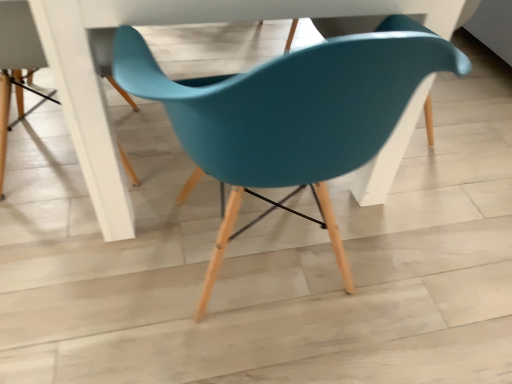
Question: In which direction should I rotate to look at teal plastic chair at upper center, which ranks as the 1th chair in left-to-right order?

Choices:
 (A) left
 (B) right

Answer: (A)

Question: Can you confirm if teal plastic chair at upper center, acting as the second chair starting from the right, is bigger than teal plastic chair at center, the first chair in the right-to-left sequence?

Choices:
 (A) no
 (B) yes

Answer: (A)

Question: Would you say teal plastic chair at center, the first chair in the right-to-left sequence, is part of teal plastic chair at upper center, acting as the second chair starting from the right,'s contents?

Choices:
 (A) no
 (B) yes

Answer: (A)

Question: Is teal plastic chair at upper center, acting as the second chair starting from the right, positioned before teal plastic chair at center, the first chair in the right-to-left sequence?

Choices:
 (A) yes
 (B) no

Answer: (B)

Question: From the image's perspective, would you say teal plastic chair at upper center, which ranks as the 1th chair in left-to-right order, is positioned over teal plastic chair at center, the first chair in the right-to-left sequence?

Choices:
 (A) yes
 (B) no

Answer: (A)

Question: From a real-world perspective, is teal plastic chair at upper center, acting as the second chair starting from the right, located beneath teal plastic chair at center, which is the 2th chair in left-to-right order?

Choices:
 (A) no
 (B) yes

Answer: (B)

Question: Is teal plastic chair at upper center, acting as the second chair starting from the right, thinner than teal plastic chair at center, which is the 2th chair in left-to-right order?

Choices:
 (A) yes
 (B) no

Answer: (A)

Question: Is teal plastic chair at center, which is the 2th chair in left-to-right order, not within teal plastic chair at upper center, which ranks as the 1th chair in left-to-right order?

Choices:
 (A) no
 (B) yes

Answer: (B)

Question: Is teal plastic chair at center, which is the 2th chair in left-to-right order, positioned with its back to teal plastic chair at upper center, acting as the second chair starting from the right?

Choices:
 (A) yes
 (B) no

Answer: (B)

Question: Is teal plastic chair at center, the first chair in the right-to-left sequence, placed right next to teal plastic chair at upper center, acting as the second chair starting from the right?

Choices:
 (A) no
 (B) yes

Answer: (A)

Question: From the image's perspective, would you say teal plastic chair at center, which is the 2th chair in left-to-right order, is shown under teal plastic chair at upper center, acting as the second chair starting from the right?

Choices:
 (A) no
 (B) yes

Answer: (B)

Question: From a real-world perspective, is teal plastic chair at center, which is the 2th chair in left-to-right order, physically below teal plastic chair at upper center, which ranks as the 1th chair in left-to-right order?

Choices:
 (A) no
 (B) yes

Answer: (A)

Question: Would you say teal plastic chair at upper center, acting as the second chair starting from the right, is part of teal plastic chair at center, the first chair in the right-to-left sequence,'s contents?

Choices:
 (A) no
 (B) yes

Answer: (A)

Question: Choose the correct answer: Is teal plastic chair at upper center, which ranks as the 1th chair in left-to-right order, inside teal plastic chair at center, which is the 2th chair in left-to-right order, or outside it?

Choices:
 (A) outside
 (B) inside

Answer: (A)